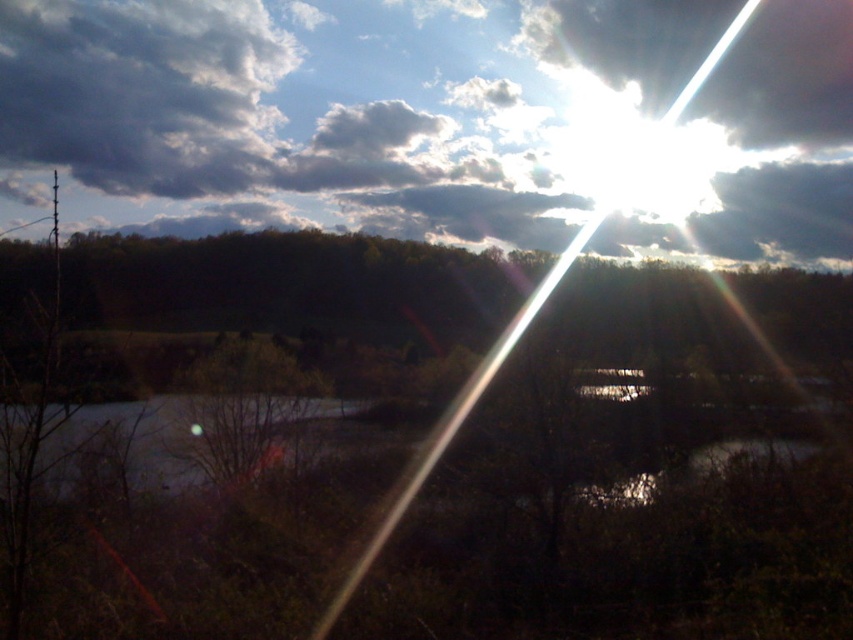
Can you confirm if cloudy sky at upper center is positioned above smooth gray water at center?

Yes, cloudy sky at upper center is above smooth gray water at center.

Is cloudy sky at upper center bigger than smooth gray water at center?

Yes, cloudy sky at upper center is bigger than smooth gray water at center.

Measure the distance between cloudy sky at upper center and camera.

236.64 feet

Where is `cloudy sky at upper center`? Image resolution: width=853 pixels, height=640 pixels. cloudy sky at upper center is located at coordinates (335, 109).

How much distance is there between brown matte tree at center and cloudy sky at upper center?

30.87 meters

Is brown matte tree at center below cloudy sky at upper center?

Yes.

What do you see at coordinates (639, 470) in the screenshot? Image resolution: width=853 pixels, height=640 pixels. I see `brown matte tree at center` at bounding box center [639, 470].

At what (x,y) coordinates should I click in order to perform the action: click on brown matte tree at center. Please return your answer as a coordinate pair (x, y). Looking at the image, I should click on (639, 470).

Which of these two, brown matte tree at center or smooth gray water at center, stands taller?

brown matte tree at center

Is brown matte tree at center closer to camera compared to smooth gray water at center?

That is False.

Which is behind, point (383, 380) or point (193, 445)?

Point (383, 380)

Locate an element on the screen. brown matte tree at center is located at coordinates (639, 470).